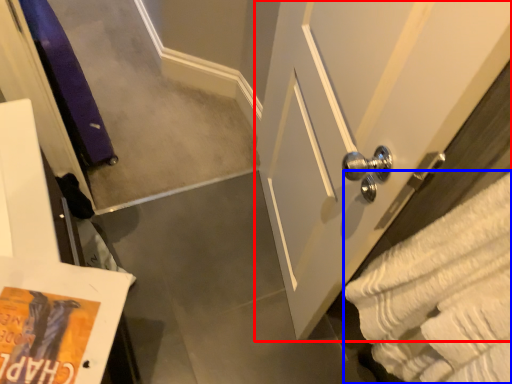
Question: Which point is further to the camera, door (highlighted by a red box) or bath towel (highlighted by a blue box)?

Choices:
 (A) door
 (B) bath towel

Answer: (A)